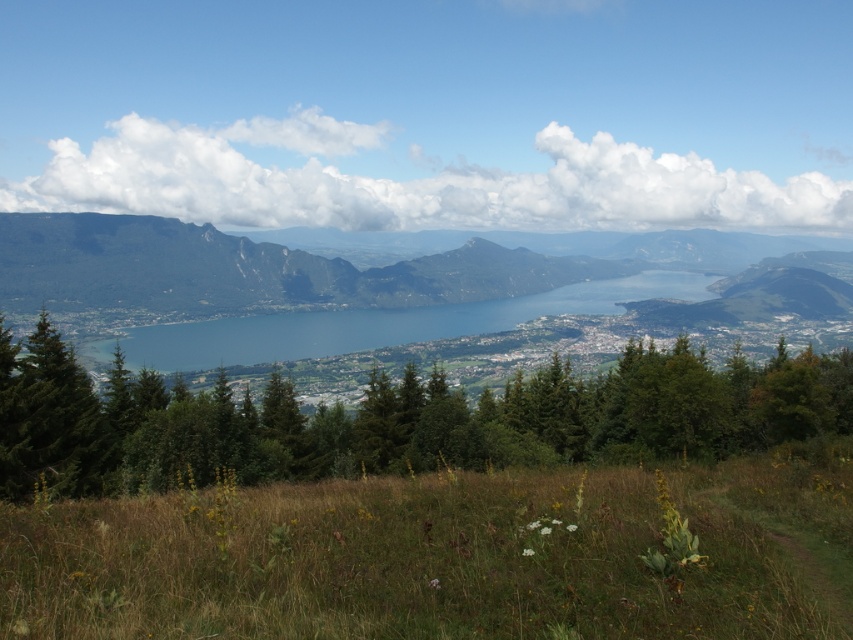
Does green leafy trees at center come behind green forested mountain at center?

No, it is in front of green forested mountain at center.

Does green leafy trees at center have a greater height compared to green forested mountain at center?

In fact, green leafy trees at center may be shorter than green forested mountain at center.

Locate an element on the screen. The image size is (853, 640). green leafy trees at center is located at coordinates (396, 417).

Which is in front, point (94, 573) or point (111, 442)?

Point (94, 573) is more forward.

Which is in front, point (714, 474) or point (225, 451)?

Point (714, 474) is in front.

Where is `green grassy field at lower center`? This screenshot has width=853, height=640. green grassy field at lower center is located at coordinates (444, 556).

Who is positioned more to the left, green forested mountain at center or blue water at center?

green forested mountain at center is more to the left.

Who is higher up, green forested mountain at center or blue water at center?

Positioned higher is green forested mountain at center.

Does point (114, 236) come behind point (346, 349)?

Yes, point (114, 236) is farther from viewer.

At what (x,y) coordinates should I click in order to perform the action: click on green forested mountain at center. Please return your answer as a coordinate pair (x, y). Looking at the image, I should click on (309, 266).